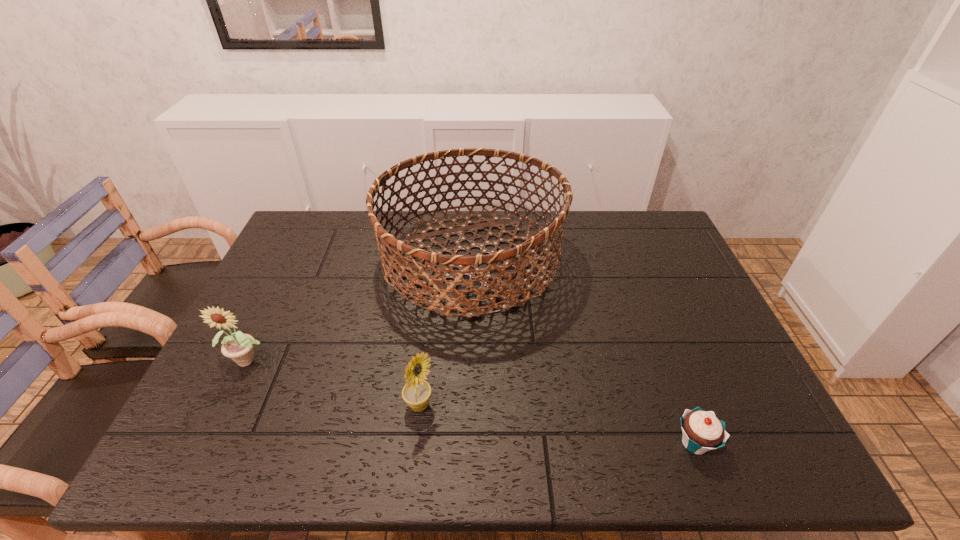
At what (x,y) coordinates should I click in order to perform the action: click on the farthest object. Please return your answer as a coordinate pair (x, y). Looking at the image, I should click on point(454,298).

Image resolution: width=960 pixels, height=540 pixels. I want to click on the tallest object, so click(x=454, y=298).

Identify the location of the left sunflower. The width and height of the screenshot is (960, 540). (239, 347).

Locate an element on the screen. Image resolution: width=960 pixels, height=540 pixels. the farther sunflower is located at coordinates (239, 347).

At what (x,y) coordinates should I click in order to perform the action: click on the nearer sunflower. Please return your answer as a coordinate pair (x, y). The height and width of the screenshot is (540, 960). Looking at the image, I should click on (416, 393).

This screenshot has width=960, height=540. Find the location of `the third tallest object`. the third tallest object is located at coordinates (416, 393).

The height and width of the screenshot is (540, 960). What are the coordinates of `the nearest object` in the screenshot? It's located at (701, 431).

Where is `cupcake`? The width and height of the screenshot is (960, 540). cupcake is located at coordinates (x=701, y=431).

I want to click on free spot located 0.360m on the right of the basket, so click(676, 261).

Locate an element on the screen. Image resolution: width=960 pixels, height=540 pixels. vacant region located 0.210m on the front-facing side of the leftmost object is located at coordinates (202, 459).